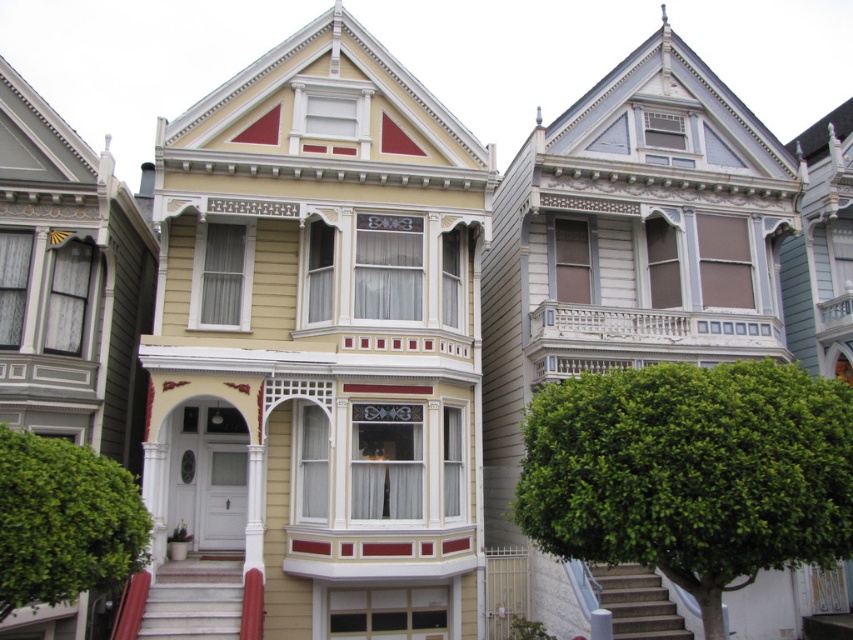
Question: Does white marble stairs at center have a larger size compared to white concrete stairs at lower right?

Choices:
 (A) no
 (B) yes

Answer: (B)

Question: Does white marble stairs at center appear on the right side of white concrete stairs at lower right?

Choices:
 (A) yes
 (B) no

Answer: (B)

Question: Which object is closer to the camera taking this photo?

Choices:
 (A) white concrete stairs at lower right
 (B) white marble stairs at center

Answer: (B)

Question: Can you confirm if white marble stairs at center is wider than white concrete stairs at lower right?

Choices:
 (A) yes
 (B) no

Answer: (A)